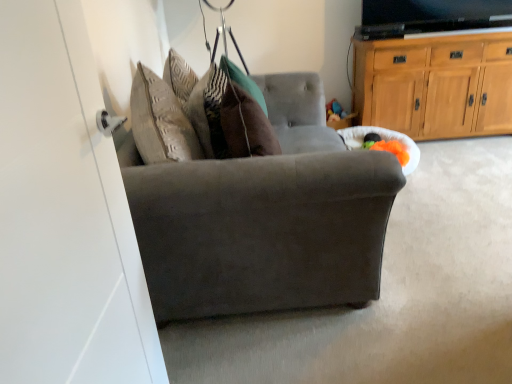
What do you see at coordinates (255, 208) in the screenshot? I see `suede gray chair at center` at bounding box center [255, 208].

What is the approximate height of brown velvet pillow at center?

22.13 inches.

This screenshot has height=384, width=512. What are the coordinates of `suede gray chair at center` in the screenshot? It's located at (255, 208).

Which of these two, brown velvet pillow at center or suede gray chair at center, is wider?

Wider between the two is suede gray chair at center.

Based on the photo, is brown velvet pillow at center not close to suede gray chair at center?

No.

Which of these two, brown velvet pillow at center or suede gray chair at center, stands shorter?

brown velvet pillow at center is shorter.

Is brown velvet pillow at center to the left or to the right of suede gray chair at center in the image?

In the image, brown velvet pillow at center appears on the left side of suede gray chair at center.

Is suede gray chair at center bigger than light brown wood cabinet at upper right?

Indeed, suede gray chair at center has a larger size compared to light brown wood cabinet at upper right.

Does suede gray chair at center lie behind light brown wood cabinet at upper right?

No, it is in front of light brown wood cabinet at upper right.

Based on the photo, from their relative heights in the image, would you say suede gray chair at center is taller or shorter than light brown wood cabinet at upper right?

Considering their sizes, suede gray chair at center has less height than light brown wood cabinet at upper right.

How many degrees apart are the facing directions of light brown wood cabinet at upper right and brown velvet pillow at center?

81 degrees separate the facing orientations of light brown wood cabinet at upper right and brown velvet pillow at center.

From a real-world perspective, who is located higher, light brown wood cabinet at upper right or brown velvet pillow at center?

brown velvet pillow at center is physically above.

Is light brown wood cabinet at upper right facing towards brown velvet pillow at center?

No, light brown wood cabinet at upper right is not aimed at brown velvet pillow at center.

Considering the positions of points (505, 43) and (253, 132), is point (505, 43) closer to camera compared to point (253, 132)?

No, it is behind (253, 132).

You are a GUI agent. You are given a task and a screenshot of the screen. Output one action in this format:
    pyautogui.click(x=<x>, y=<y>)
    Task: Click on the pillow located behind the suede gray chair at center
    The height and width of the screenshot is (384, 512).
    Given the screenshot: What is the action you would take?
    pyautogui.click(x=246, y=125)

Is suede gray chair at center taller or shorter than brown velvet pillow at center?

suede gray chair at center is taller than brown velvet pillow at center.

Is suede gray chair at center directly adjacent to brown velvet pillow at center?

No, suede gray chair at center is not touching brown velvet pillow at center.

Is brown velvet pillow at center with light brown wood cabinet at upper right?

No, brown velvet pillow at center is not with light brown wood cabinet at upper right.

How many degrees apart are the facing directions of brown velvet pillow at center and light brown wood cabinet at upper right?

There is a 81-degree angle between the facing directions of brown velvet pillow at center and light brown wood cabinet at upper right.

From the image's perspective, would you say brown velvet pillow at center is shown under light brown wood cabinet at upper right?

Indeed, from the image's perspective, brown velvet pillow at center is shown beneath light brown wood cabinet at upper right.

From a real-world perspective, is light brown wood cabinet at upper right positioned above or below suede gray chair at center?

light brown wood cabinet at upper right is situated higher than suede gray chair at center in the real world.

How much distance is there between light brown wood cabinet at upper right and suede gray chair at center?

They are 3.17 meters apart.

Is light brown wood cabinet at upper right surrounding suede gray chair at center?

No, suede gray chair at center is not inside light brown wood cabinet at upper right.

Considering the sizes of light brown wood cabinet at upper right and suede gray chair at center in the image, is light brown wood cabinet at upper right taller or shorter than suede gray chair at center?

light brown wood cabinet at upper right is taller than suede gray chair at center.

Locate an element on the screen. The image size is (512, 384). pillow lying above the suede gray chair at center (from the image's perspective) is located at coordinates (246, 125).

You are a GUI agent. You are given a task and a screenshot of the screen. Output one action in this format:
    pyautogui.click(x=<x>, y=<y>)
    Task: Click on the chair below the light brown wood cabinet at upper right (from a real-world perspective)
    
    Given the screenshot: What is the action you would take?
    pyautogui.click(x=255, y=208)

When comparing their distances from light brown wood cabinet at upper right, does suede gray chair at center or brown velvet pillow at center seem closer?

suede gray chair at center is positioned closer to the anchor light brown wood cabinet at upper right.

From the image, which object appears to be farther from brown velvet pillow at center, light brown wood cabinet at upper right or suede gray chair at center?

light brown wood cabinet at upper right is further to brown velvet pillow at center.

Considering their positions, is brown velvet pillow at center positioned closer to light brown wood cabinet at upper right than suede gray chair at center?

suede gray chair at center.

From the image, which object appears to be nearer to brown velvet pillow at center, suede gray chair at center or light brown wood cabinet at upper right?

suede gray chair at center.

From the image, which object appears to be farther from suede gray chair at center, light brown wood cabinet at upper right or brown velvet pillow at center?

Based on the image, light brown wood cabinet at upper right appears to be further to suede gray chair at center.

From the image, which object appears to be farther from suede gray chair at center, brown velvet pillow at center or light brown wood cabinet at upper right?

light brown wood cabinet at upper right is further to suede gray chair at center.

Where is `chair between brown velvet pillow at center and light brown wood cabinet at upper right from left to right`? chair between brown velvet pillow at center and light brown wood cabinet at upper right from left to right is located at coordinates (255, 208).